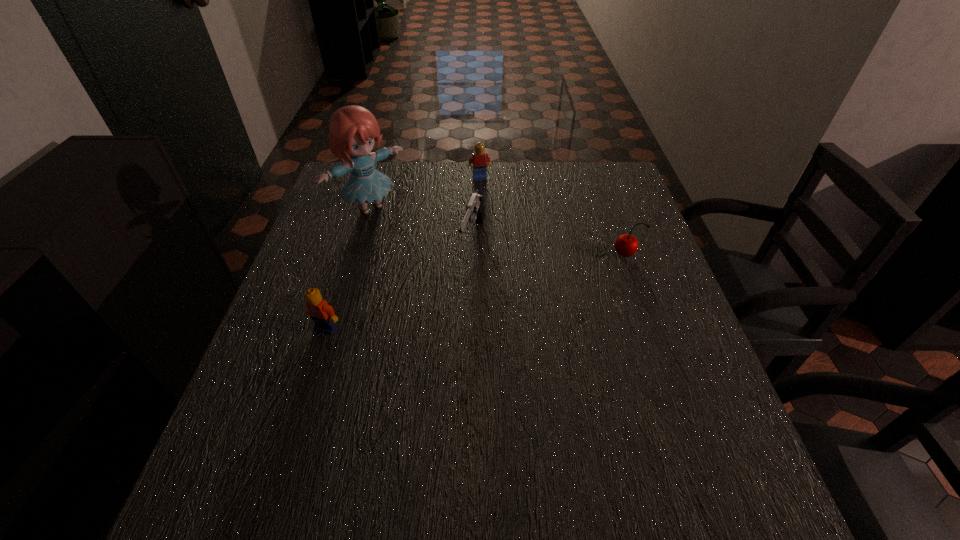
The width and height of the screenshot is (960, 540). I want to click on Lego that is at the left edge, so click(323, 315).

You are a GUI agent. You are given a task and a screenshot of the screen. Output one action in this format:
    pyautogui.click(x=<x>, y=<y>)
    Task: Click on the doll that is at the left edge
    This screenshot has width=960, height=540.
    Given the screenshot: What is the action you would take?
    pyautogui.click(x=353, y=130)

Locate an element on the screen. Image resolution: width=960 pixels, height=540 pixels. object situated at the right edge is located at coordinates (626, 245).

In order to click on object at the far left corner in this screenshot , I will do `click(353, 130)`.

The width and height of the screenshot is (960, 540). In order to click on vacant point at the far edge in this screenshot , I will do `click(551, 177)`.

In the image, there is a desktop. In order to click on vacant space at the near edge in this screenshot , I will do `click(450, 420)`.

Image resolution: width=960 pixels, height=540 pixels. Identify the location of vacant region at the left edge of the desktop. (329, 218).

The width and height of the screenshot is (960, 540). In order to click on vacant space at the right edge in this screenshot , I will do `click(665, 362)`.

In the image, there is a desktop. Where is `free region at the near left corner`? The height and width of the screenshot is (540, 960). free region at the near left corner is located at coordinates (300, 440).

Find the location of a particular element. This screenshot has width=960, height=540. vacant region at the far right corner of the desktop is located at coordinates (609, 173).